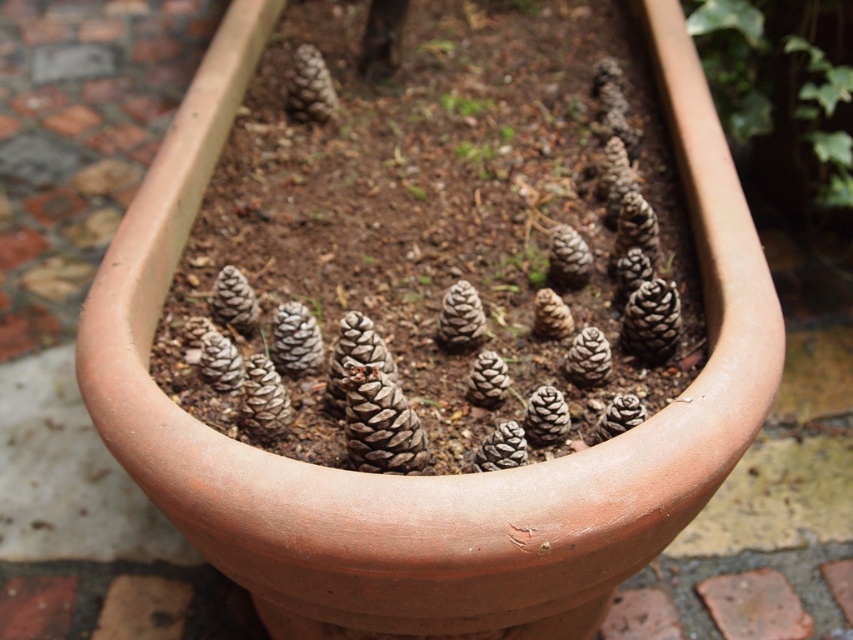
This screenshot has height=640, width=853. In order to click on green matte ivy at upper right in this screenshot , I will do `click(782, 83)`.

Who is more forward, (804, 93) or (461, 113)?

Point (461, 113)

Image resolution: width=853 pixels, height=640 pixels. What are the coordinates of `green matte ivy at upper right` in the screenshot? It's located at pyautogui.click(x=782, y=83).